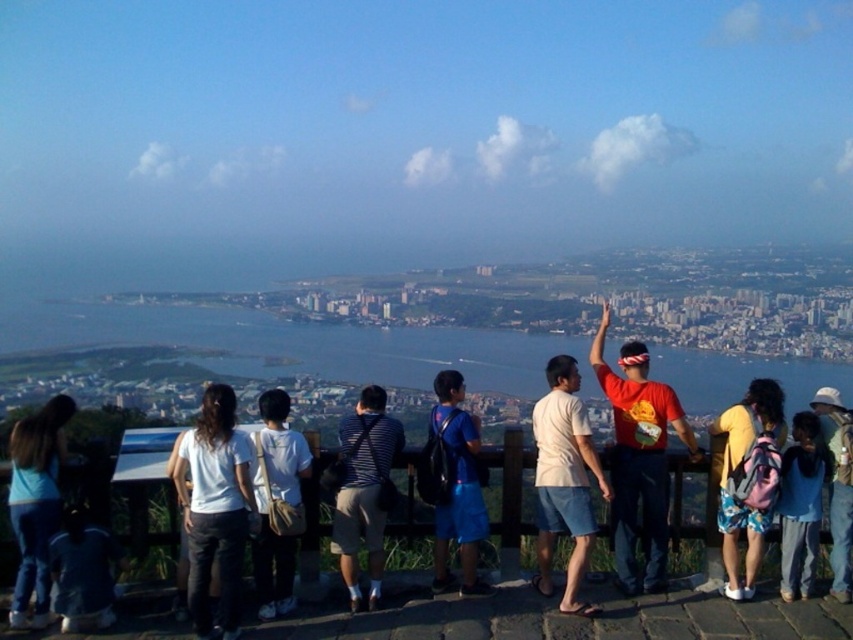
Question: Can you confirm if striped fabric shirt at center is thinner than blue denim jeans at lower right?

Choices:
 (A) yes
 (B) no

Answer: (B)

Question: Which object is closer to the camera taking this photo?

Choices:
 (A) white canvas backpack at center
 (B) white cotton shirt at center

Answer: (B)

Question: In this image, where is pink backpack at center located relative to blue denim jeans at lower right?

Choices:
 (A) right
 (B) left

Answer: (B)

Question: Is blue water at center to the left of white cotton shirt at center from the viewer's perspective?

Choices:
 (A) no
 (B) yes

Answer: (A)

Question: Which point appears farthest from the camera in this image?

Choices:
 (A) (840, 592)
 (B) (277, 609)

Answer: (B)

Question: Which of the following is the closest to the observer?

Choices:
 (A) (224, 513)
 (B) (740, 513)
 (C) (39, 522)

Answer: (C)